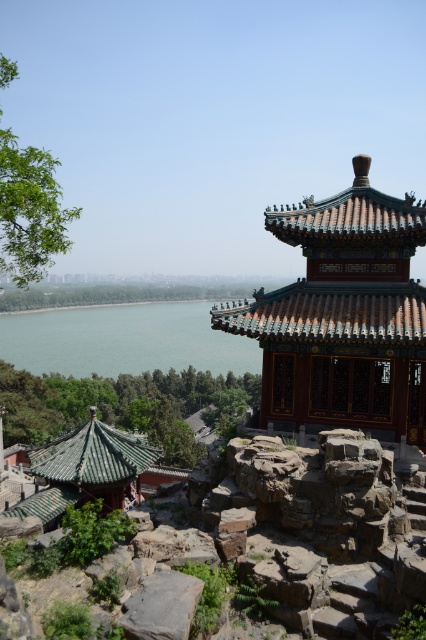
You are a tour guide leading a group to the shiny dark green gazebo at upper right. You notice a gray rough rock at center blocking the path. Can your group walk around it without deviating more than 15 meters from the straight path to the gazebo?

The distance between the shiny dark green gazebo at upper right and the gray rough rock at center is 10.80 meters. Since the deviation required to go around the rock is likely less than 15 meters, the group can walk around it without exceeding the 15 meter deviation limit.

You are standing in the garden and notice the green water at lower left and the gray rough rock at center. Which one is taller from your perspective?

The green water at lower left is taller than the gray rough rock at center.

You are a visitor in this traditional Chinese garden. You see the shiny dark green gazebo at upper right and the green water at lower left. Which object is positioned higher in the image?

The shiny dark green gazebo at upper right is located above the green water at lower left, so it is positioned higher in the image.